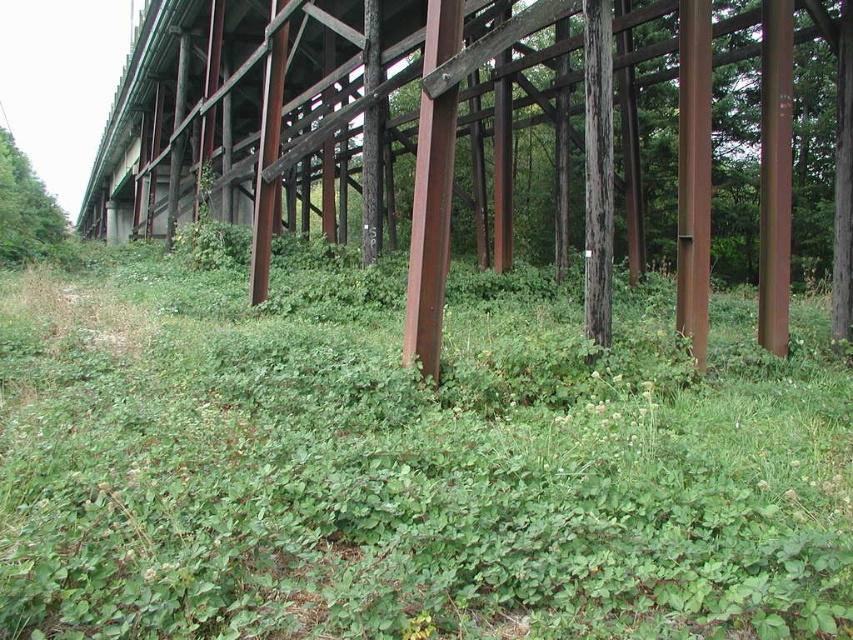
Is green leafy grass at center below rusty metal bridge at center?

Correct, green leafy grass at center is located below rusty metal bridge at center.

Between green leafy grass at center and rusty metal bridge at center, which one appears on the left side from the viewer's perspective?

rusty metal bridge at center is more to the left.

Who is more distant from viewer, [334,534] or [131,195]?

The point [131,195] is behind.

This screenshot has height=640, width=853. In order to click on green leafy grass at center in this screenshot , I will do `click(407, 461)`.

Which is more to the left, rusty metal bridge at center or green leafy tree at upper left?

From the viewer's perspective, green leafy tree at upper left appears more on the left side.

This screenshot has height=640, width=853. What do you see at coordinates (459, 129) in the screenshot?
I see `rusty metal bridge at center` at bounding box center [459, 129].

What are the coordinates of `rusty metal bridge at center` in the screenshot? It's located at (459, 129).

Does green leafy grass at center appear on the left side of green leafy tree at upper left?

Incorrect, green leafy grass at center is not on the left side of green leafy tree at upper left.

Is the position of green leafy grass at center more distant than that of green leafy tree at upper left?

No, green leafy grass at center is closer to the viewer.

Is point (674, 452) less distant than point (10, 189)?

Yes, it is.

At what (x,y) coordinates should I click in order to perform the action: click on green leafy grass at center. Please return your answer as a coordinate pair (x, y). This screenshot has width=853, height=640. Looking at the image, I should click on (x=407, y=461).